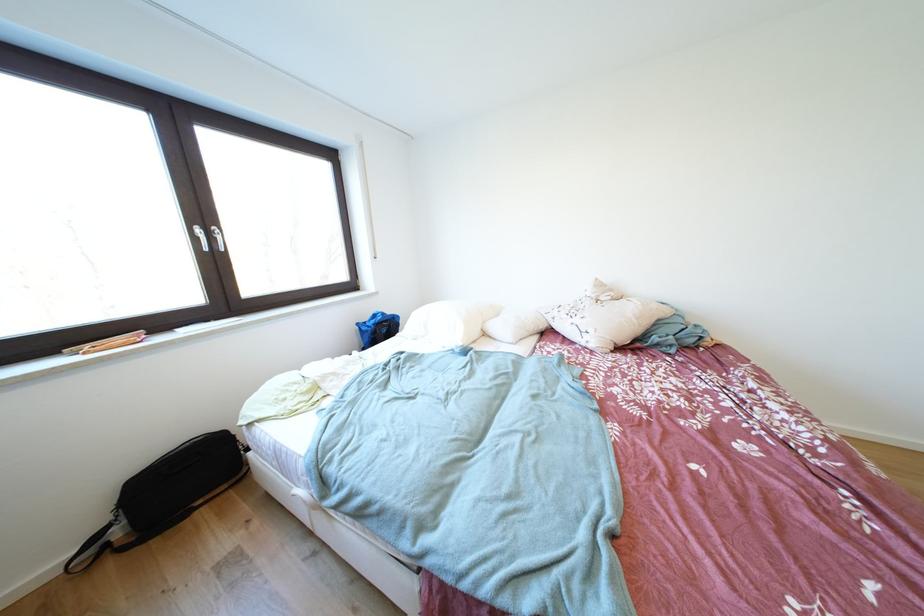
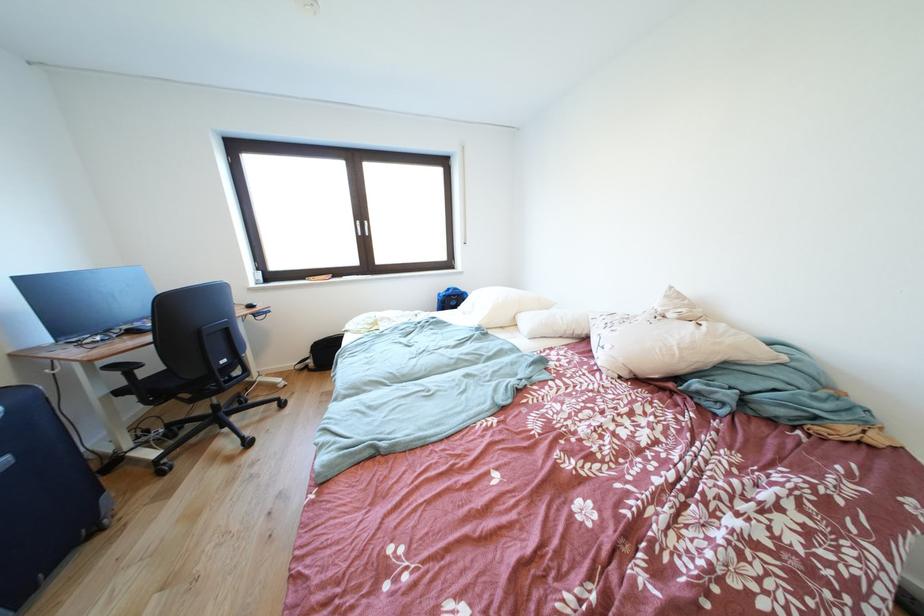
In the second image, find the point that corresponds to (x=207, y=235) in the first image.

(367, 228)